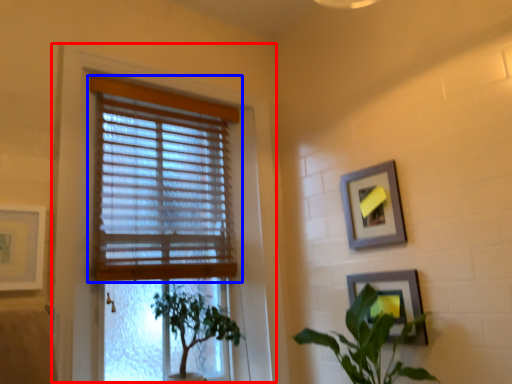
Question: Which point is closer to the camera, window frame (highlighted by a red box) or window blind (highlighted by a blue box)?

Choices:
 (A) window frame
 (B) window blind

Answer: (A)